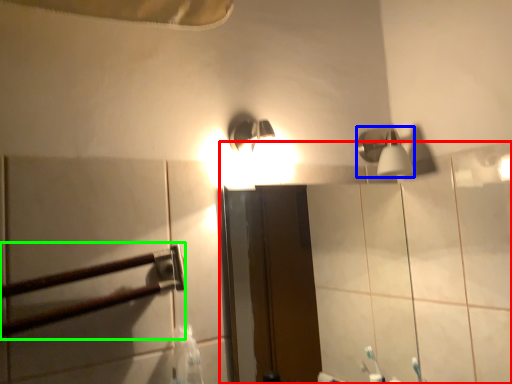
Question: Which is nearer to the mirror (highlighted by a red box)? shower (highlighted by a blue box) or rail (highlighted by a green box).

Choices:
 (A) shower
 (B) rail

Answer: (A)